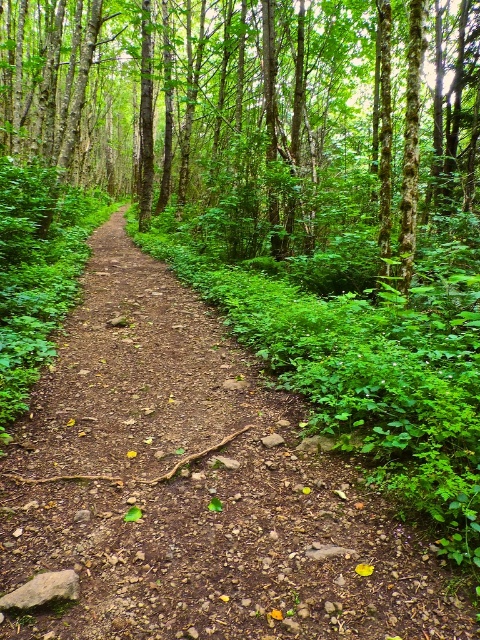
From the picture: You are a hiker walking along the brown dirt path at center and the brown rough tree at center. Which one is narrower in width?

The brown dirt path at center is narrower in width compared to the brown rough tree at center.

You are hiking along the forest trail and want to take a photo of the brown dirt path at center and the brown rough tree at center. Which object should you focus on first if you want the one closer to you to be sharp?

The brown dirt path at center is in front of the brown rough tree at center, so you should focus on the brown dirt path at center first to ensure it is sharp.